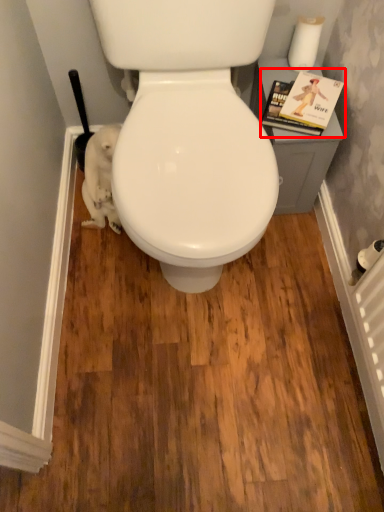
Question: From the image's perspective, where is magazine (annotated by the red box) located relative to toilet paper?

Choices:
 (A) above
 (B) below

Answer: (B)